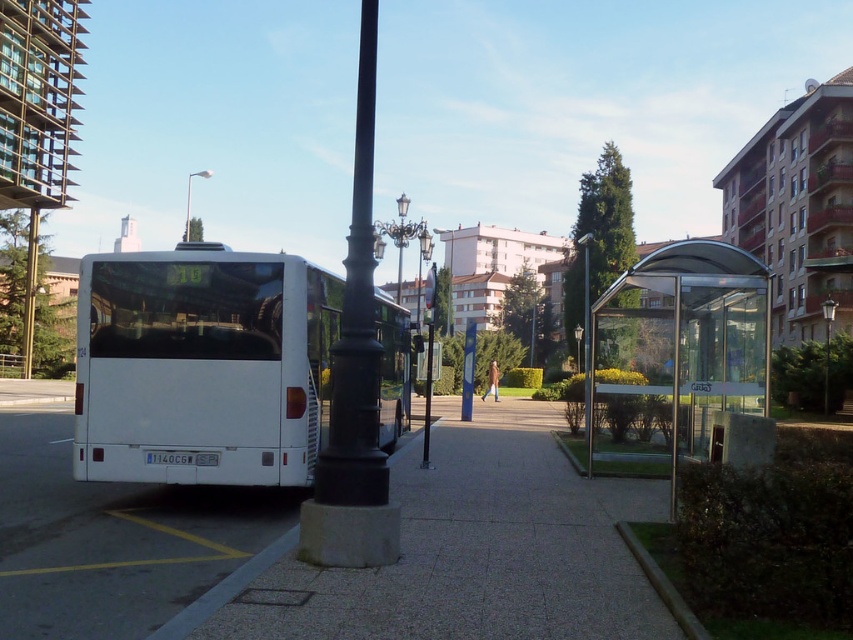
In the scene shown: Does black cast iron pole at center appear over gray concrete curb at lower right?

Yes.

Which is more to the right, black cast iron pole at center or gray concrete curb at lower right?

Positioned to the right is gray concrete curb at lower right.

Is point (357, 564) less distant than point (660, 577)?

No, it is behind (660, 577).

Identify the location of black cast iron pole at center. This screenshot has width=853, height=640. (354, 380).

From the picture: Does transparent glass bus stop at right come behind gray concrete curb at lower right?

Yes, transparent glass bus stop at right is behind gray concrete curb at lower right.

Does transparent glass bus stop at right have a greater width compared to gray concrete curb at lower right?

Correct, the width of transparent glass bus stop at right exceeds that of gray concrete curb at lower right.

Who is more distant from viewer, [762,340] or [659,584]?

Point [762,340]

Locate an element on the screen. transparent glass bus stop at right is located at coordinates (675, 356).

Does smooth concrete pavement at center have a larger size compared to polished brass streetlight at center?

No, smooth concrete pavement at center is not bigger than polished brass streetlight at center.

Identify the location of smooth concrete pavement at center. The width and height of the screenshot is (853, 640). (467, 550).

You are a GUI agent. You are given a task and a screenshot of the screen. Output one action in this format:
    pyautogui.click(x=<x>, y=<y>)
    Task: Click on the smooth concrete pavement at center
    The width and height of the screenshot is (853, 640).
    Given the screenshot: What is the action you would take?
    pyautogui.click(x=467, y=550)